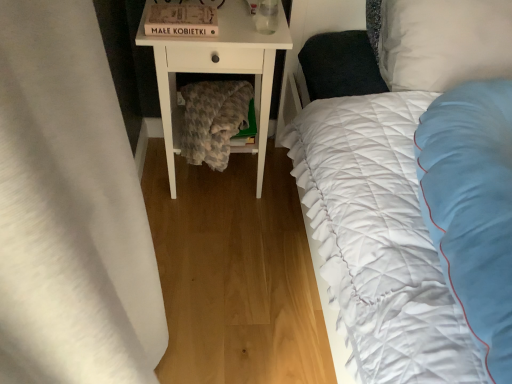
Question: From the image's perspective, does clear glass at upper center appear higher than white soft pillow at upper right?

Choices:
 (A) yes
 (B) no

Answer: (A)

Question: From the image's perspective, is clear glass at upper center located beneath white soft pillow at upper right?

Choices:
 (A) no
 (B) yes

Answer: (A)

Question: Can you confirm if clear glass at upper center is smaller than white soft pillow at upper right?

Choices:
 (A) yes
 (B) no

Answer: (A)

Question: Is clear glass at upper center to the right of white soft pillow at upper right from the viewer's perspective?

Choices:
 (A) no
 (B) yes

Answer: (A)

Question: Considering the relative sizes of clear glass at upper center and white soft pillow at upper right in the image provided, is clear glass at upper center shorter than white soft pillow at upper right?

Choices:
 (A) no
 (B) yes

Answer: (B)

Question: Is white fabric curtain at left spatially inside fuzzy gray blanket at lower center, or outside of it?

Choices:
 (A) inside
 (B) outside

Answer: (B)

Question: Is point (58, 160) closer or farther from the camera than point (208, 109)?

Choices:
 (A) farther
 (B) closer

Answer: (B)

Question: From the image's perspective, is white fabric curtain at left located above or below fuzzy gray blanket at lower center?

Choices:
 (A) below
 (B) above

Answer: (A)

Question: Would you say white fabric curtain at left is to the left or to the right of fuzzy gray blanket at lower center in the picture?

Choices:
 (A) right
 (B) left

Answer: (B)

Question: Visually, is clear glass at upper center positioned to the left or to the right of white matte nightstand at center?

Choices:
 (A) left
 (B) right

Answer: (B)

Question: From a real-world perspective, is clear glass at upper center positioned above or below white matte nightstand at center?

Choices:
 (A) above
 (B) below

Answer: (A)

Question: Is clear glass at upper center in front of or behind white matte nightstand at center in the image?

Choices:
 (A) front
 (B) behind

Answer: (A)

Question: In terms of height, does clear glass at upper center look taller or shorter compared to white matte nightstand at center?

Choices:
 (A) short
 (B) tall

Answer: (A)

Question: Is fuzzy gray blanket at lower center situated inside clear glass at upper center or outside?

Choices:
 (A) outside
 (B) inside

Answer: (A)

Question: Does point (206, 162) appear closer or farther from the camera than point (268, 0)?

Choices:
 (A) closer
 (B) farther

Answer: (B)